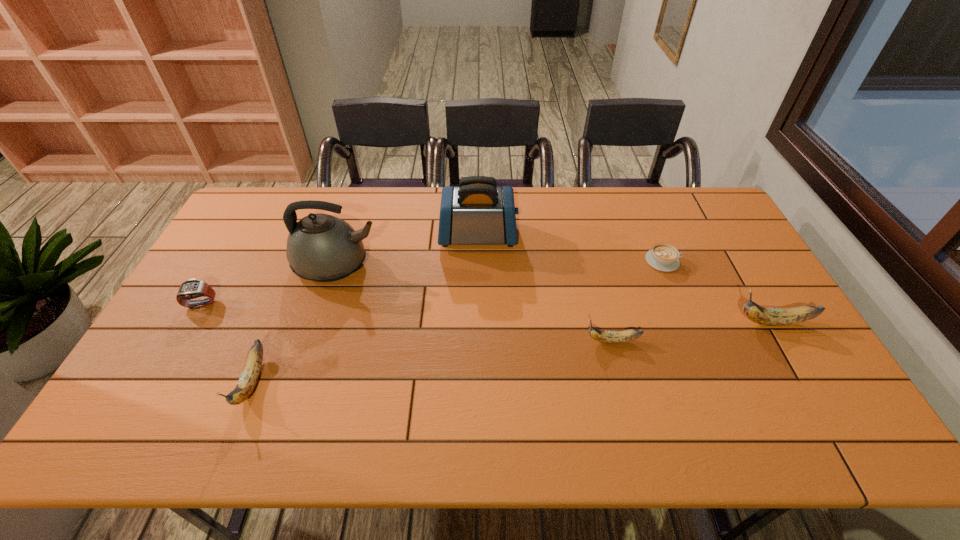
I want to click on free space between the watch and the kettle, so click(x=269, y=285).

Select which object appears as the fifth closest to the rightmost banana. Please provide its 2D coordinates. Your answer should be formatted as a tuple, i.e. [(x, y)], where the tuple contains the x and y coordinates of a point satisfying the conditions above.

[(249, 377)]

The height and width of the screenshot is (540, 960). What are the coordinates of `object that ranks as the closest to the kettle` in the screenshot? It's located at pyautogui.click(x=477, y=212).

Where is `banana that is the closest to the fifth object from left to right`? The width and height of the screenshot is (960, 540). banana that is the closest to the fifth object from left to right is located at coordinates (765, 316).

I want to click on banana that is the closest to the toaster, so click(626, 335).

The width and height of the screenshot is (960, 540). What are the coordinates of `free space that satisfies the following two spatial constraints: 1. at the spout of the kettle; 2. at the stem of the second tallest banana` in the screenshot? It's located at (300, 382).

The width and height of the screenshot is (960, 540). Find the location of `free spot that satisfies the following two spatial constraints: 1. on the front-facing side of the fourth object from right to left; 2. at the stem of the leftmost banana`. free spot that satisfies the following two spatial constraints: 1. on the front-facing side of the fourth object from right to left; 2. at the stem of the leftmost banana is located at coordinates (477, 382).